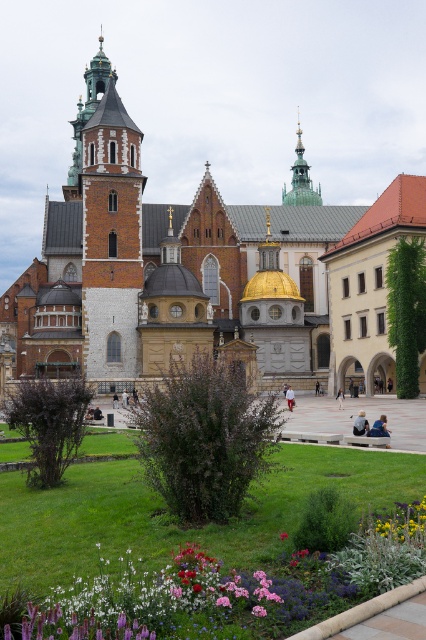
You are standing in front of the grand historical building and want to take a photo. You notice two points marked in the image. Which point is closer to you, point (282, 189) or point (250, 612)?

Point (282, 189) is closer to you because it is further to the viewer than point (250, 612).